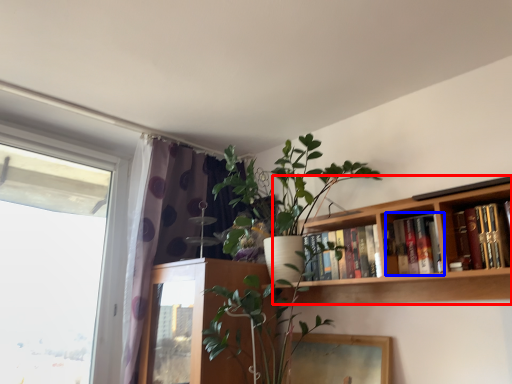
Question: Among these objects, which one is farthest to the camera, bookcase (highlighted by a red box) or book (highlighted by a blue box)?

Choices:
 (A) bookcase
 (B) book

Answer: (B)